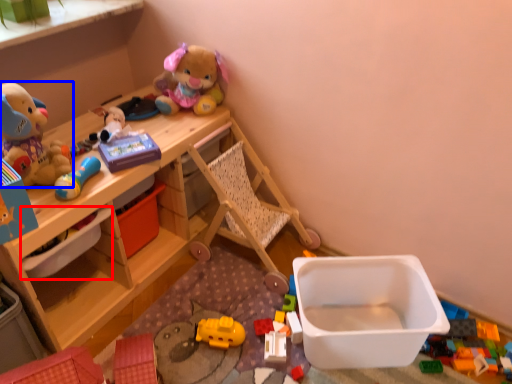
Question: Among these objects, which one is nearest to the camera, storage box (highlighted by a red box) or toy (highlighted by a blue box)?

Choices:
 (A) storage box
 (B) toy

Answer: (B)